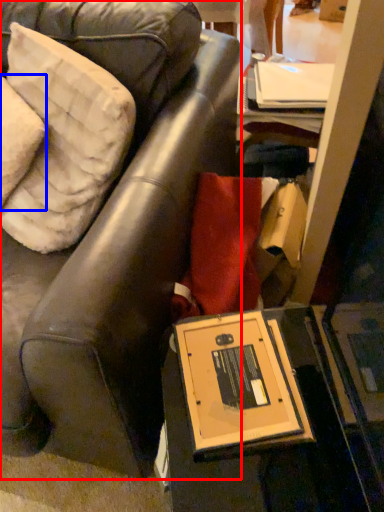
Question: Among these objects, which one is nearest to the camera, chair (highlighted by a red box) or pillow (highlighted by a blue box)?

Choices:
 (A) chair
 (B) pillow

Answer: (A)